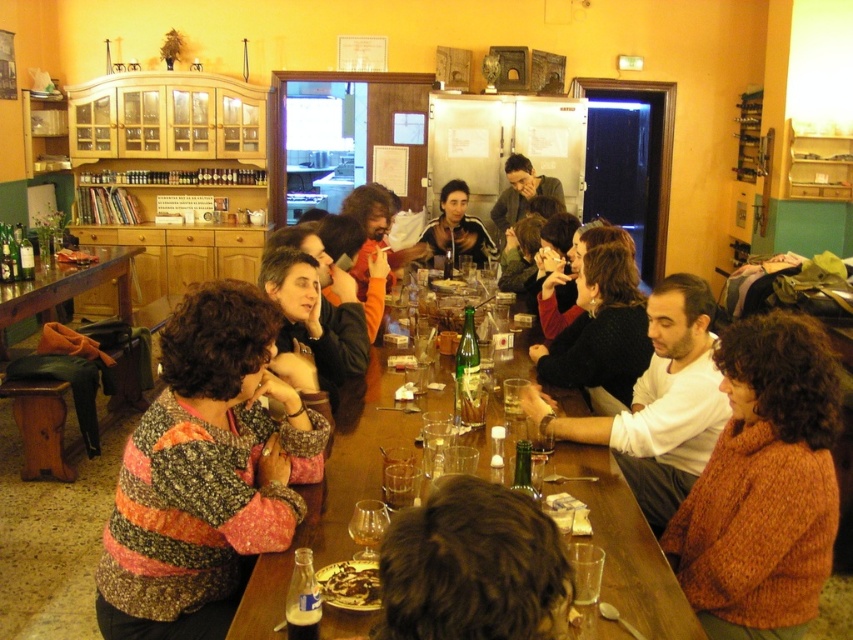
Who is lower down, dark brown sweater at center or matte brown bread at center?

dark brown sweater at center is lower down.

Is dark brown sweater at center above matte brown bread at center?

No.

Locate an element on the screen. The image size is (853, 640). dark brown sweater at center is located at coordinates (601, 330).

The image size is (853, 640). I want to click on dark brown sweater at center, so click(x=601, y=330).

Looking at this image, is dark gray fabric jacket at center further to camera compared to green glass bottle at center?

Yes.

Which is behind, point (460, 236) or point (479, 376)?

The point (460, 236) is behind.

Identify the location of dark gray fabric jacket at center. (457, 227).

You are a GUI agent. You are given a task and a screenshot of the screen. Output one action in this format:
    pyautogui.click(x=<x>, y=<y>)
    Task: Click on the dark gray fabric jacket at center
    Image resolution: width=853 pixels, height=640 pixels.
    Given the screenshot: What is the action you would take?
    pyautogui.click(x=457, y=227)

Which is in front, point (234, 541) or point (386, 416)?

Point (234, 541)

Is striped sweater at center bigger than wooden table at center?

Actually, striped sweater at center might be smaller than wooden table at center.

Which is in front, point (149, 538) or point (294, 545)?

Point (149, 538) is in front.

Identify the location of striped sweater at center. (206, 474).